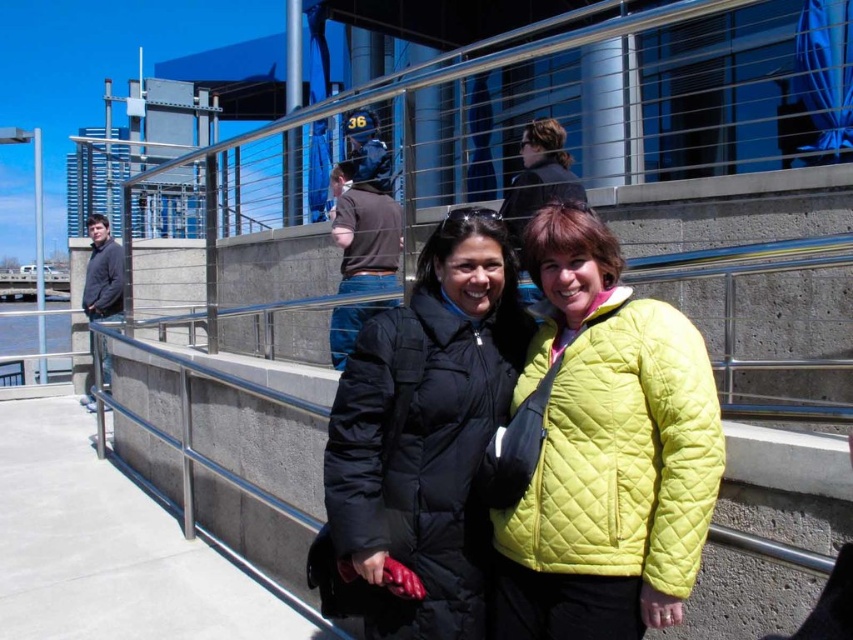
You are a photographer trying to capture a photo of both the black quilted jacket at center and the dark gray quilted jacket at left. Based on their positions, can you tell which one is closer to the camera?

The black quilted jacket at center is below the dark gray quilted jacket at left, so the dark gray quilted jacket at left is closer to the camera.

You are a photographer trying to capture a clear shot of both the black quilted jacket at center and the lime quilted jacket at center. However, the metal railing in the background is blocking your view. Which jacket is more likely to be visible through the gaps in the railing?

The black quilted jacket at center is positioned over the lime quilted jacket at center, so the lime quilted jacket at center is more likely to be visible through the gaps in the railing since it is behind the black one.